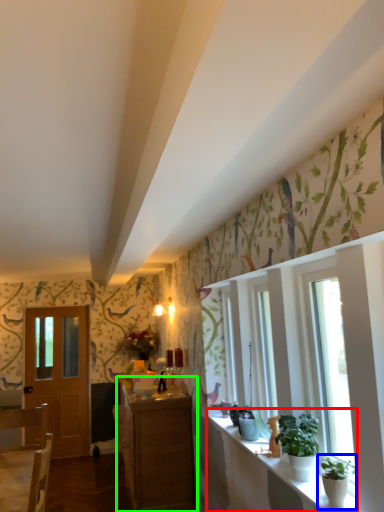
Question: Estimate the real-world distances between objects in this image. Which object is closer to window sill (highlighted by a red box), houseplant (highlighted by a blue box) or cabinetry (highlighted by a green box)?

Choices:
 (A) houseplant
 (B) cabinetry

Answer: (A)